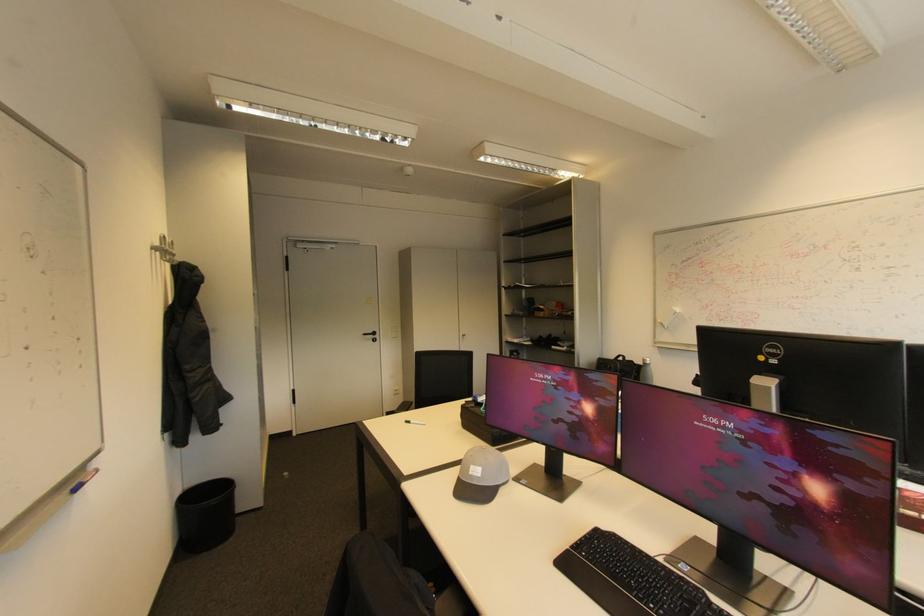
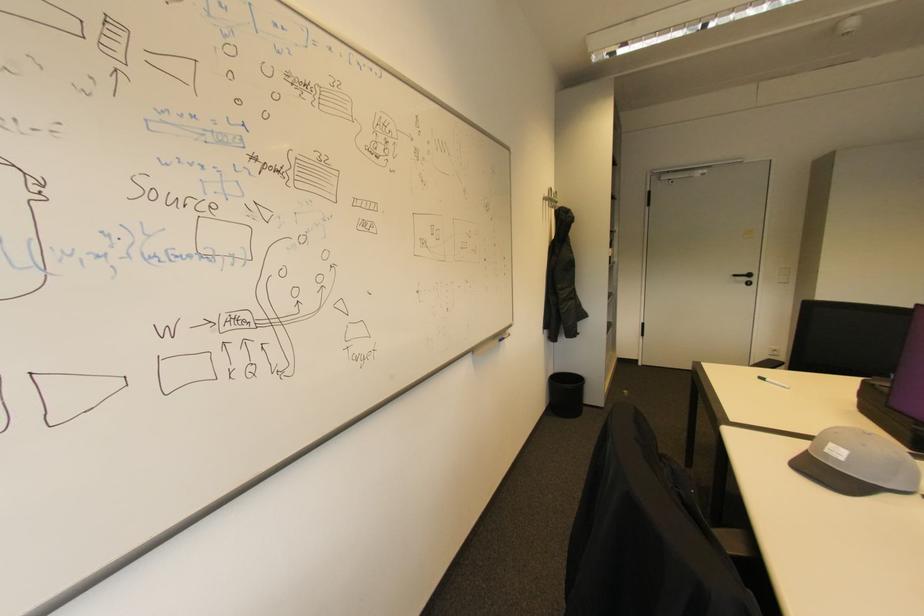
Locate, in the second image, the point that corresponds to [380,334] in the first image.

(755, 276)